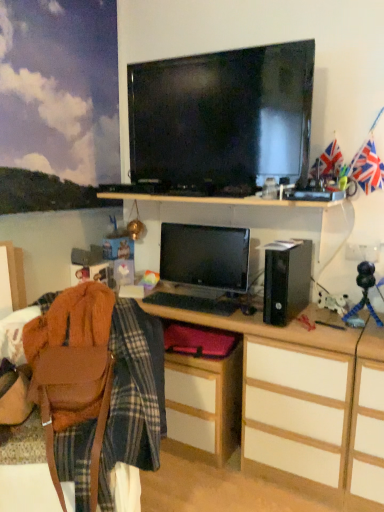
Question: From a real-world perspective, is wooden desk at center positioned above or below union jack flag at upper right?

Choices:
 (A) above
 (B) below

Answer: (B)

Question: Considering the positions of point (372, 422) and point (352, 168), is point (372, 422) closer or farther from the camera than point (352, 168)?

Choices:
 (A) farther
 (B) closer

Answer: (B)

Question: Which object is the farthest from the matte black television at upper center?

Choices:
 (A) brown leather bag at lower left
 (B) union jack flag at upper right
 (C) wooden desk at center
 (D) matte wood cabinet at lower center
 (E) black plastic speaker at right

Answer: (D)

Question: Based on their relative distances, which object is nearer to the matte wood cabinet at lower center?

Choices:
 (A) matte black television at upper center
 (B) brown leather bag at lower left
 (C) satin black monitor at center
 (D) wooden desk at center
 (E) black plastic speaker at right

Answer: (D)